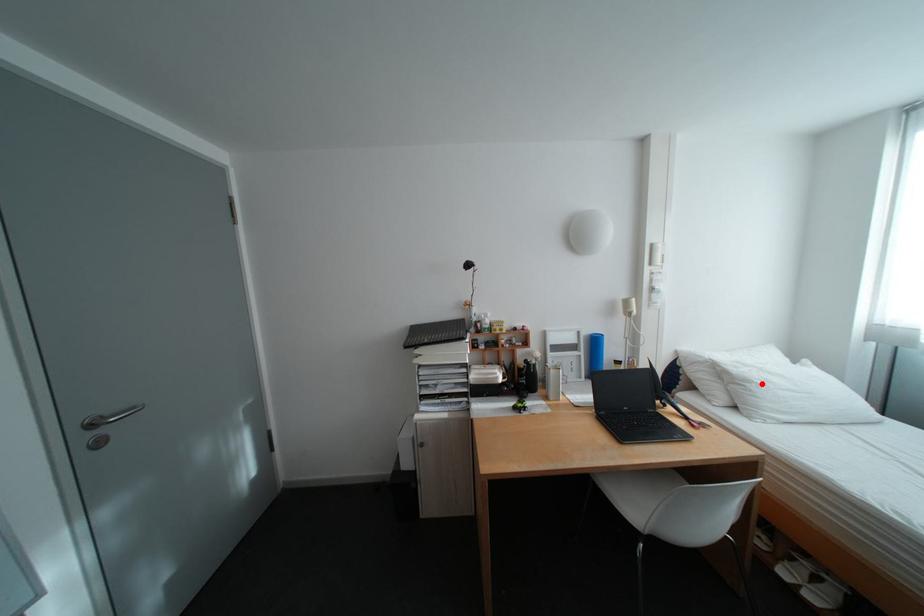
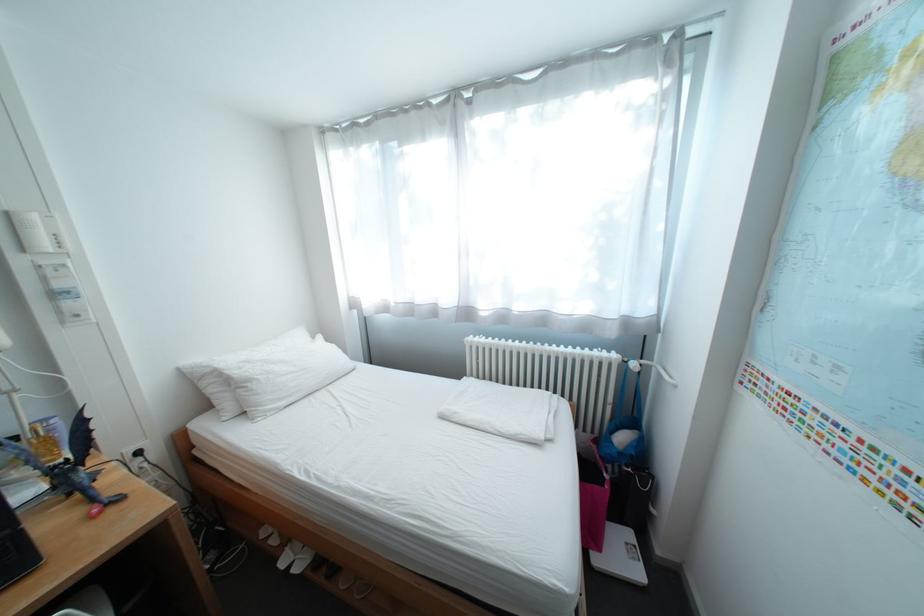
Locate, in the second image, the point that corresponds to the highlighted location in the first image.

(263, 383)